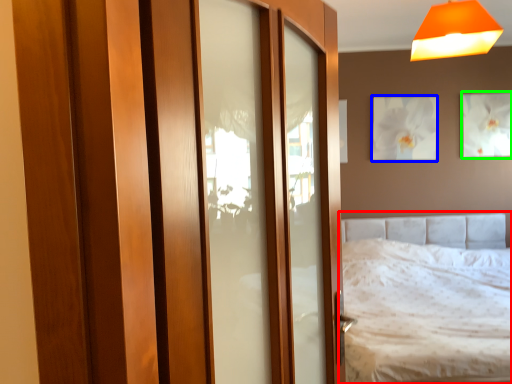
Question: Which object is positioned farthest from bed (highlighted by a red box)? Select from picture frame (highlighted by a blue box) and picture frame (highlighted by a green box).

Choices:
 (A) picture frame
 (B) picture frame

Answer: (B)